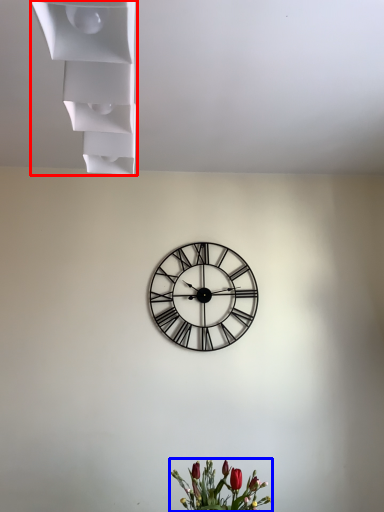
Question: Which object appears closest to the camera in this image, shelf (highlighted by a red box) or floral arrangement (highlighted by a blue box)?

Choices:
 (A) shelf
 (B) floral arrangement

Answer: (A)